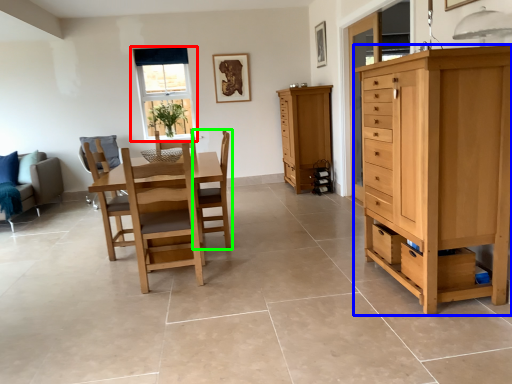
Question: Considering the real-world distances, which object is farthest from window (highlighted by a red box)? chest of drawers (highlighted by a blue box) or chair (highlighted by a green box)?

Choices:
 (A) chest of drawers
 (B) chair

Answer: (A)